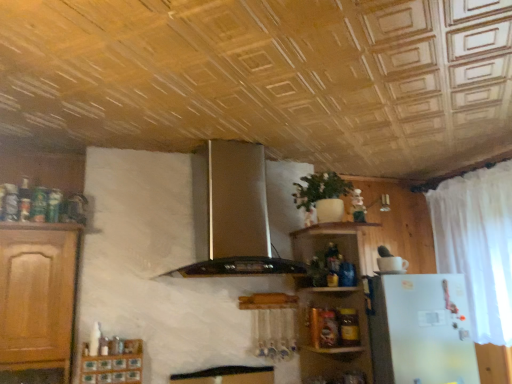
Question: From a real-world perspective, is wooden shelves at upper right located higher than wooden spice rack at lower left?

Choices:
 (A) yes
 (B) no

Answer: (A)

Question: Are wooden shelves at upper right and wooden spice rack at lower left beside each other?

Choices:
 (A) no
 (B) yes

Answer: (A)

Question: Is wooden shelves at upper right taller than wooden spice rack at lower left?

Choices:
 (A) yes
 (B) no

Answer: (A)

Question: Is wooden shelves at upper right not near wooden spice rack at lower left?

Choices:
 (A) yes
 (B) no

Answer: (A)

Question: Is wooden shelves at upper right located outside wooden spice rack at lower left?

Choices:
 (A) no
 (B) yes

Answer: (B)

Question: Is wooden shelves at upper right taller or shorter than white sheer curtain at right?

Choices:
 (A) tall
 (B) short

Answer: (B)

Question: Does point (321, 241) appear closer or farther from the camera than point (503, 291)?

Choices:
 (A) farther
 (B) closer

Answer: (A)

Question: Is wooden shelves at upper right spatially inside white sheer curtain at right, or outside of it?

Choices:
 (A) inside
 (B) outside

Answer: (B)

Question: Is wooden shelves at upper right to the left or to the right of white sheer curtain at right in the image?

Choices:
 (A) right
 (B) left

Answer: (B)

Question: Is wooden shelves at upper right situated inside wooden spice rack at lower left or outside?

Choices:
 (A) outside
 (B) inside

Answer: (A)

Question: Considering the positions of wooden shelves at upper right and wooden spice rack at lower left in the image, is wooden shelves at upper right wider or thinner than wooden spice rack at lower left?

Choices:
 (A) wide
 (B) thin

Answer: (A)

Question: In terms of height, does wooden shelves at upper right look taller or shorter compared to wooden spice rack at lower left?

Choices:
 (A) short
 (B) tall

Answer: (B)

Question: Is wooden shelves at upper right in front of or behind wooden spice rack at lower left in the image?

Choices:
 (A) front
 (B) behind

Answer: (B)

Question: From the image's perspective, is satin silver exhaust hood at center located above or below green matte plant at center?

Choices:
 (A) above
 (B) below

Answer: (B)

Question: Considering their positions, is satin silver exhaust hood at center located in front of or behind green matte plant at center?

Choices:
 (A) behind
 (B) front

Answer: (B)